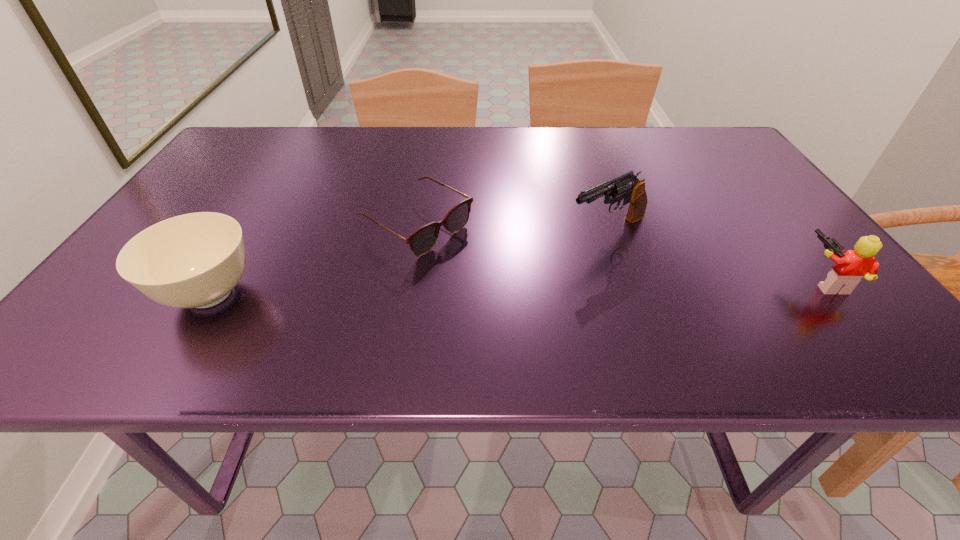
The width and height of the screenshot is (960, 540). I want to click on free space on the desktop that is between the leftmost object and the rightmost object and is positioned along the barrel of the gun, so click(x=496, y=288).

What are the coordinates of `vacant space on the desktop that is between the leftmost object and the Lego and is positioned at the front view of the shortest object` in the screenshot? It's located at (522, 288).